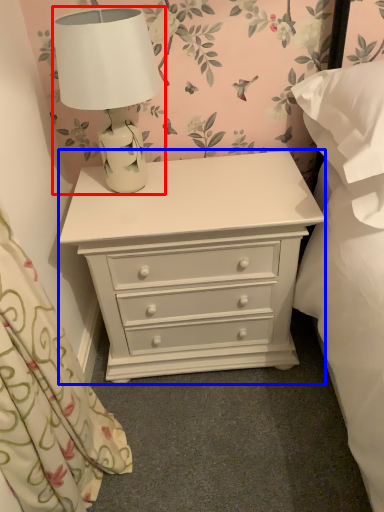
Question: Which object appears farthest to the camera in this image, lamp (highlighted by a red box) or chest of drawers (highlighted by a blue box)?

Choices:
 (A) lamp
 (B) chest of drawers

Answer: (B)